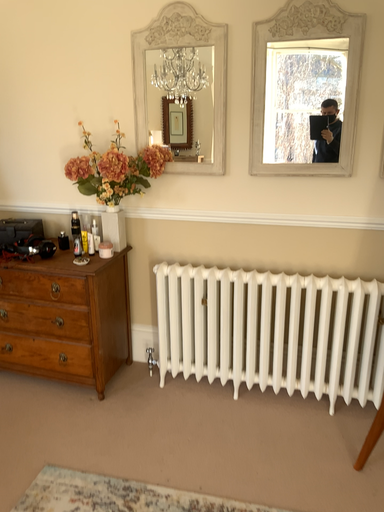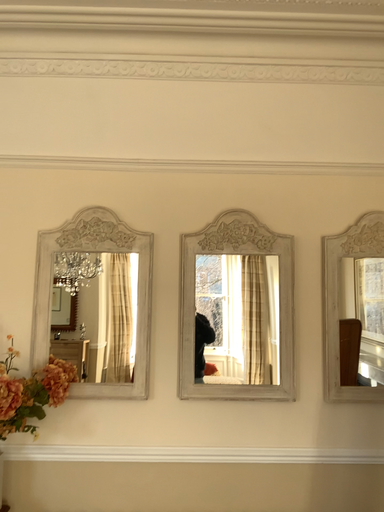
Question: How did the camera likely rotate when shooting the video?

Choices:
 (A) rotated upward
 (B) rotated downward

Answer: (A)